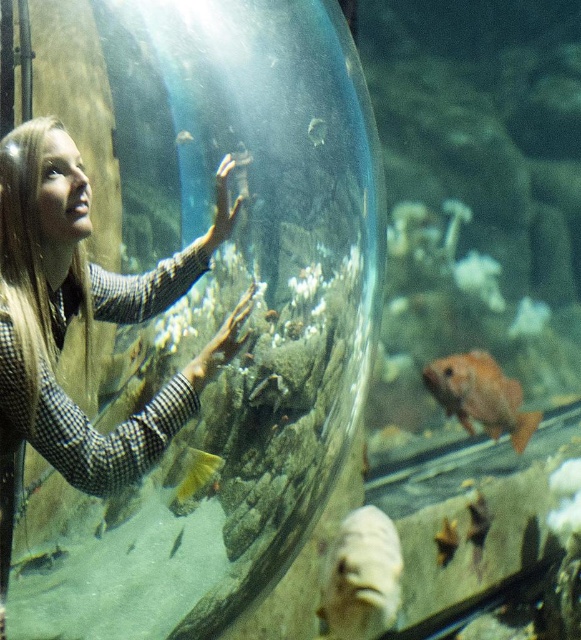
Question: Where is blonde hair at left located in relation to white matte fish at lower center in the image?

Choices:
 (A) right
 (B) left

Answer: (B)

Question: Is orange matte fish at lower right positioned behind translucent glass fish at center?

Choices:
 (A) yes
 (B) no

Answer: (A)

Question: Is translucent glass fish at center above shiny orange fish at center?

Choices:
 (A) yes
 (B) no

Answer: (A)

Question: Which object is closer to the camera taking this photo?

Choices:
 (A) white matte fish at lower center
 (B) shiny yellow fish at center

Answer: (B)

Question: Among these points, which one is farthest from the camera?

Choices:
 (A) (191, 458)
 (B) (279, 388)
 (C) (44, 237)

Answer: (B)

Question: Among these objects, which one is nearest to the camera?

Choices:
 (A) shiny yellow fish at center
 (B) shiny orange fish at center
 (C) white matte fish at lower center

Answer: (A)